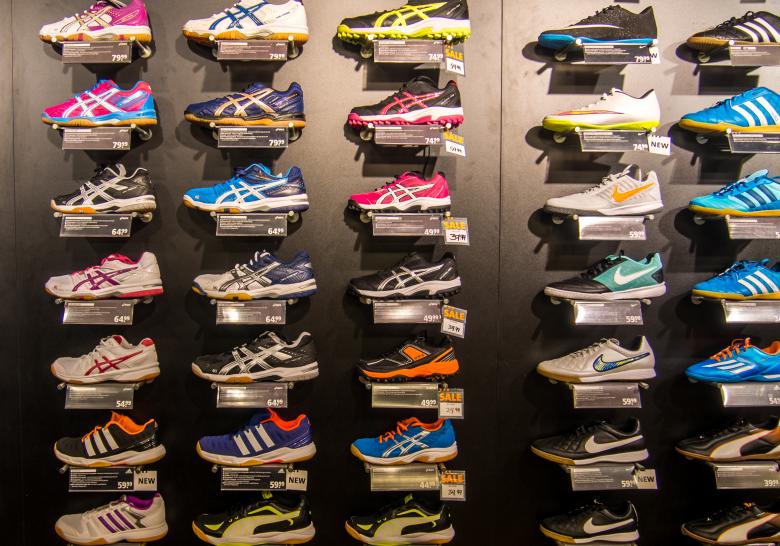
The image size is (780, 546). In order to click on right column of shoes in this screenshot , I will do `click(752, 525)`, `click(750, 436)`, `click(746, 360)`, `click(756, 278)`, `click(747, 192)`, `click(747, 117)`, `click(741, 32)`.